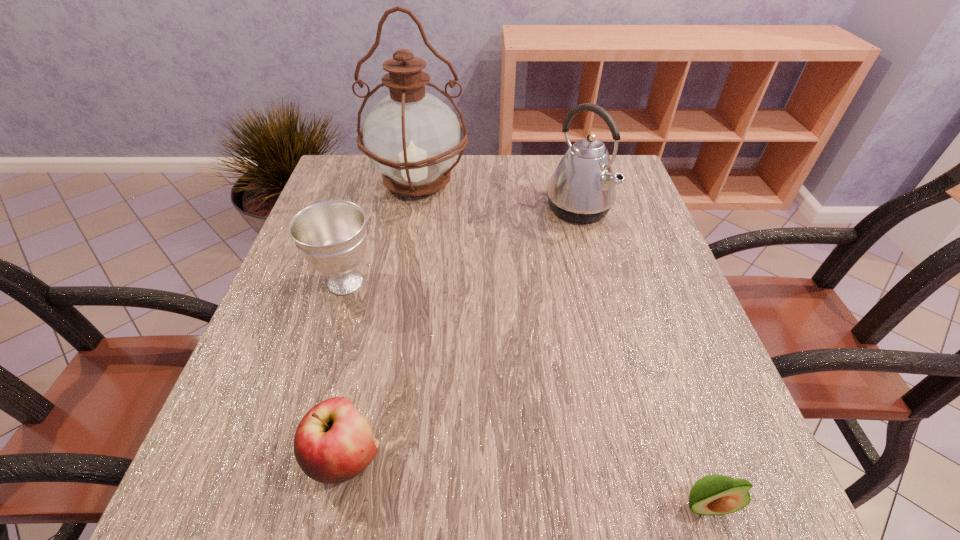
The width and height of the screenshot is (960, 540). In order to click on object that is positioned at the near left corner in this screenshot , I will do `click(333, 443)`.

Find the location of a particular element. The image size is (960, 540). object present at the far right corner is located at coordinates (582, 189).

Identify the location of object that is at the near right corner. (715, 494).

In the image, there is a desktop. At what (x,y) coordinates should I click in order to perform the action: click on vacant area at the near edge. Please return your answer as a coordinate pair (x, y). The height and width of the screenshot is (540, 960). Looking at the image, I should click on (552, 500).

You are a GUI agent. You are given a task and a screenshot of the screen. Output one action in this format:
    pyautogui.click(x=<x>, y=<y>)
    Task: Click on the free space at the left edge of the desktop
    The height and width of the screenshot is (540, 960).
    Given the screenshot: What is the action you would take?
    pyautogui.click(x=276, y=359)

The width and height of the screenshot is (960, 540). I want to click on blank area at the right edge, so click(632, 287).

Locate an element on the screen. This screenshot has height=540, width=960. free region at the far left corner is located at coordinates (364, 190).

In order to click on vacant space at the near left corner in this screenshot , I will do `click(229, 493)`.

The width and height of the screenshot is (960, 540). In the image, there is a desktop. What are the coordinates of `blank space at the far right corner` in the screenshot? It's located at (616, 200).

This screenshot has width=960, height=540. In order to click on vacant space at the near right corner of the desktop in this screenshot , I will do `click(684, 489)`.